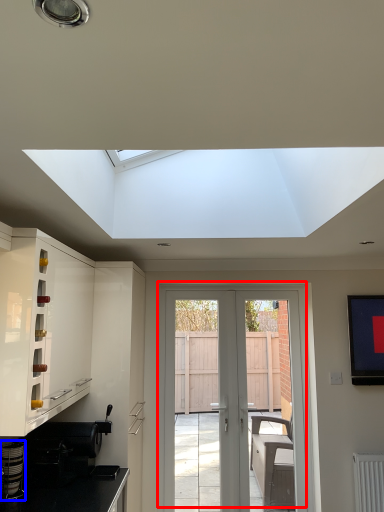
Question: Which of the following is the closest to the observer, door (highlighted by a red box) or appliance (highlighted by a blue box)?

Choices:
 (A) door
 (B) appliance

Answer: (B)